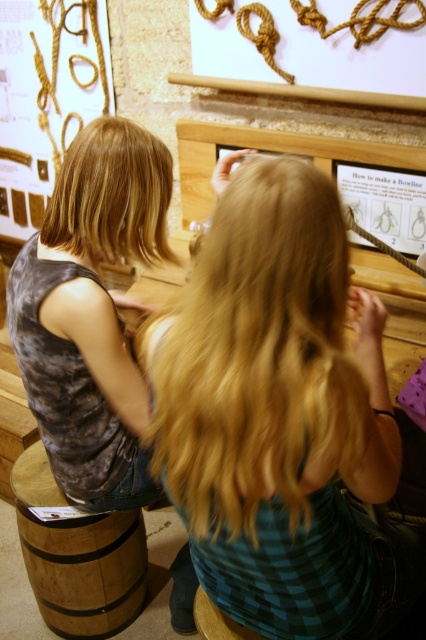
Looking at this image, you are standing in front of the educational exhibit and notice the blonde smooth hair at upper left and the wooden stool at lower center. Which object is taller?

The blonde smooth hair at upper left is taller than the wooden stool at lower center.

You are a fashion designer observing the scene. You need to determine if the matte gray tank top at left can fit on the wooden stool at lower center. Based on their sizes, can it fit?

The matte gray tank top at left is wider than the wooden stool at lower center, so it might not fit properly on the stool.